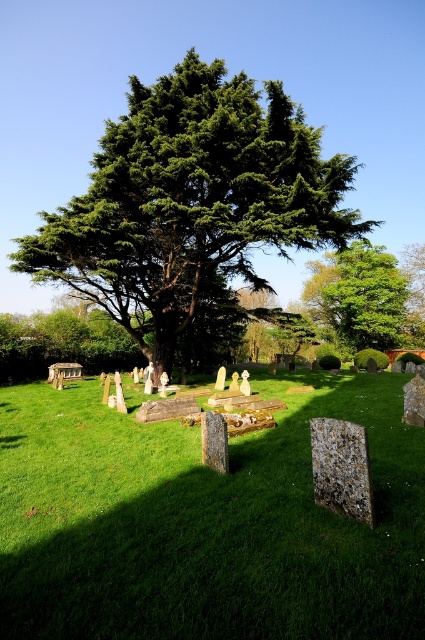
Question: Which point is farther from the camera taking this photo?

Choices:
 (A) (297, 212)
 (B) (156, 584)
 (C) (353, 326)

Answer: (C)

Question: Which object is positioned farthest from the green leafy tree at upper right?

Choices:
 (A) green leafy tree at upper center
 (B) speckled stone gravestone at lower center
 (C) green stone gravestones at center

Answer: (B)

Question: Where is green leafy tree at upper center located in relation to speckled stone gravestone at lower center in the image?

Choices:
 (A) left
 (B) right

Answer: (A)

Question: Does green stone gravestones at center appear over green leafy tree at upper right?

Choices:
 (A) yes
 (B) no

Answer: (B)

Question: Does green stone gravestones at center appear under green leafy tree at upper right?

Choices:
 (A) no
 (B) yes

Answer: (B)

Question: Which of the following is the farthest from the observer?

Choices:
 (A) (354, 330)
 (B) (272, 611)
 (C) (328, 244)

Answer: (A)